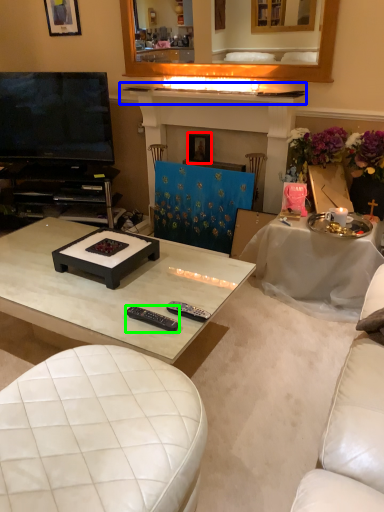
Question: Estimate the real-world distances between objects in this image. Which object is closer to picture frame (highlighted by a red box), mantle (highlighted by a blue box) or remote control (highlighted by a green box)?

Choices:
 (A) mantle
 (B) remote control

Answer: (A)